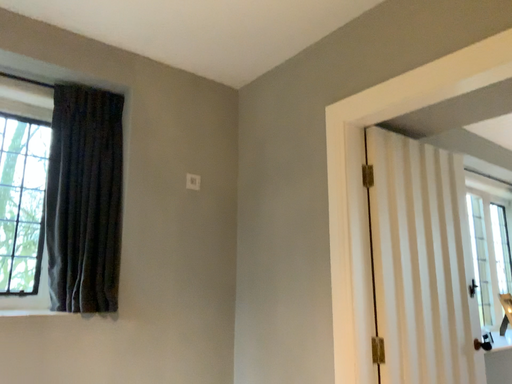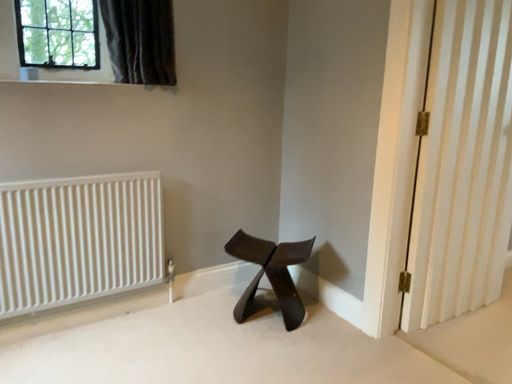
Question: How did the camera likely rotate when shooting the video?

Choices:
 (A) rotated downward
 (B) rotated upward

Answer: (A)